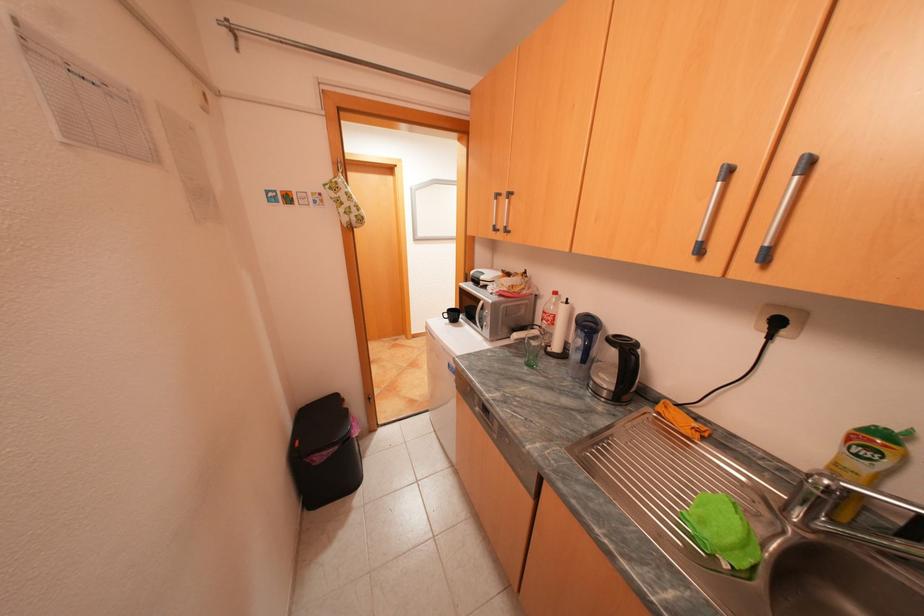
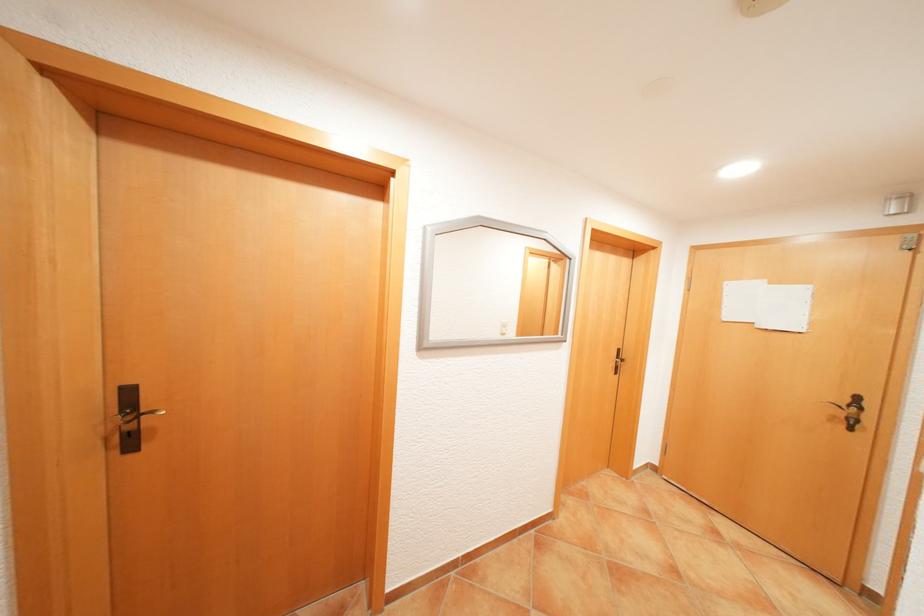
Question: In a continuous first-person perspective shot, in which direction is the camera moving?

Choices:
 (A) Left
 (B) Right
 (C) Forward
 (D) Backward

Answer: (C)